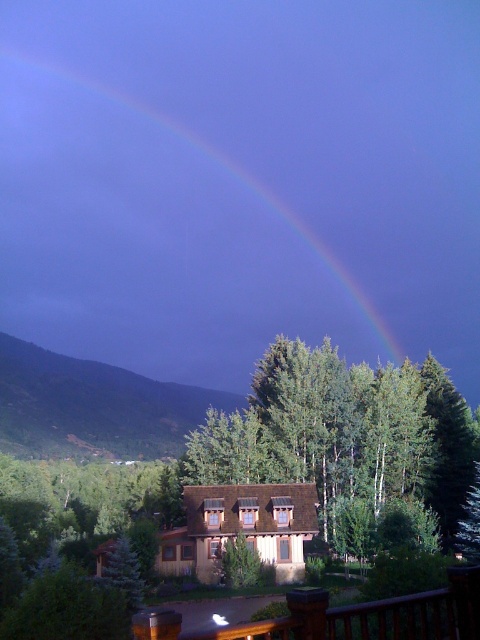
What do you see at coordinates (153, 243) in the screenshot? The height and width of the screenshot is (640, 480). I see `rainbow at upper center` at bounding box center [153, 243].

Does point (119, 157) come behind point (328, 472)?

Yes.

Between point (242, 209) and point (268, 422), which one is positioned behind?

The point (242, 209) is behind.

What are the coordinates of `rainbow at upper center` in the screenshot? It's located at (153, 243).